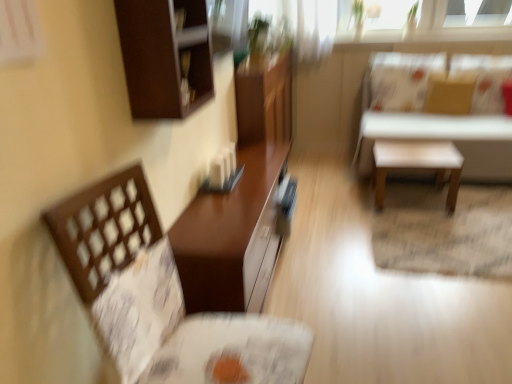
Where is `free space to the right of white matte stool at center`? free space to the right of white matte stool at center is located at coordinates (481, 198).